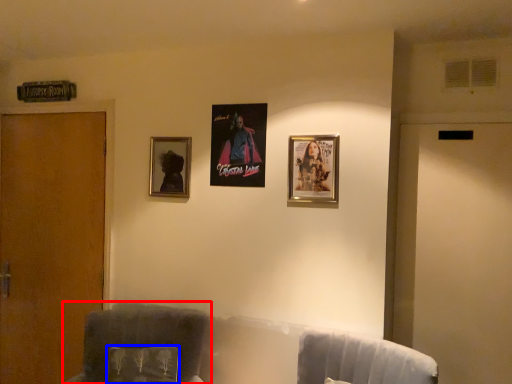
Question: Which object appears closest to the camera in this image, furniture (highlighted by a red box) or pillow (highlighted by a blue box)?

Choices:
 (A) furniture
 (B) pillow

Answer: (A)